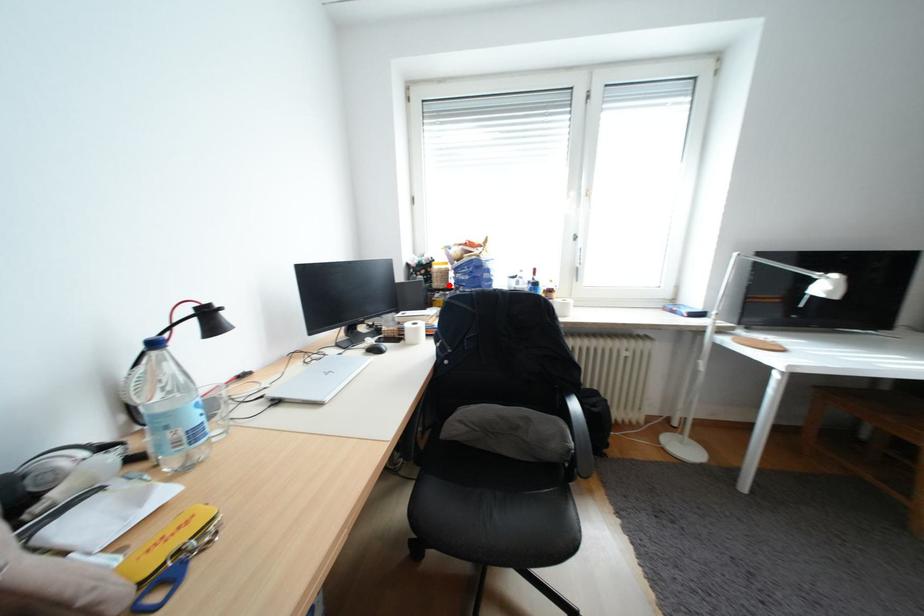
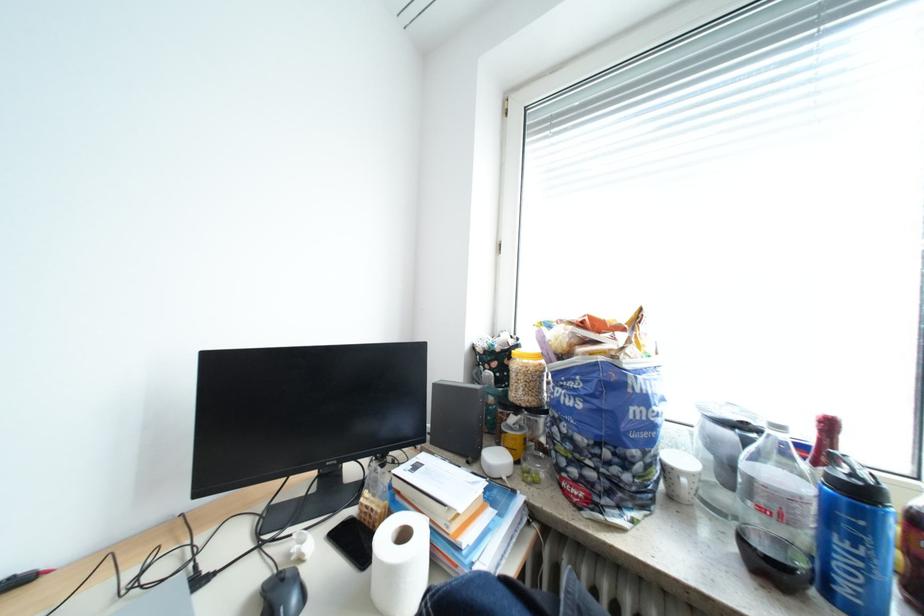
In the second image, find the point that corresponds to the highlighted location in the first image.

(529, 394)